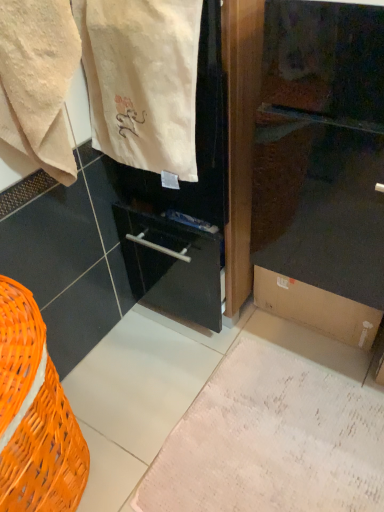
Question: Does brown cardboard box at lower right have a lesser height compared to white textured rug at lower center?

Choices:
 (A) no
 (B) yes

Answer: (A)

Question: Is brown cardboard box at lower right not inside white textured rug at lower center?

Choices:
 (A) no
 (B) yes

Answer: (B)

Question: Is brown cardboard box at lower right positioned before white textured rug at lower center?

Choices:
 (A) no
 (B) yes

Answer: (A)

Question: Is brown cardboard box at lower right to the left of white textured rug at lower center from the viewer's perspective?

Choices:
 (A) yes
 (B) no

Answer: (B)

Question: Is white textured rug at lower center surrounded by brown cardboard box at lower right?

Choices:
 (A) yes
 (B) no

Answer: (B)

Question: Considering the relative positions of brown cardboard box at lower right and beige cotton towel at upper left in the image provided, is brown cardboard box at lower right to the left or to the right of beige cotton towel at upper left?

Choices:
 (A) left
 (B) right

Answer: (B)

Question: From a real-world perspective, relative to beige cotton towel at upper left, is brown cardboard box at lower right vertically above or below?

Choices:
 (A) above
 (B) below

Answer: (B)

Question: Choose the correct answer: Is brown cardboard box at lower right inside beige cotton towel at upper left or outside it?

Choices:
 (A) outside
 (B) inside

Answer: (A)

Question: Based on their sizes in the image, would you say brown cardboard box at lower right is bigger or smaller than beige cotton towel at upper left?

Choices:
 (A) big
 (B) small

Answer: (A)

Question: Choose the correct answer: Is beige cotton towel at upper left inside white textured rug at lower center or outside it?

Choices:
 (A) inside
 (B) outside

Answer: (B)

Question: From a real-world perspective, relative to white textured rug at lower center, is beige cotton towel at upper left vertically above or below?

Choices:
 (A) below
 (B) above

Answer: (B)

Question: Is beige cotton towel at upper left bigger or smaller than white textured rug at lower center?

Choices:
 (A) small
 (B) big

Answer: (B)

Question: Based on their positions, is beige cotton towel at upper left located to the left or right of white textured rug at lower center?

Choices:
 (A) right
 (B) left

Answer: (B)

Question: Looking at their shapes, would you say beige cotton towel at upper left is wider or thinner than orange wicker basket at lower left?

Choices:
 (A) thin
 (B) wide

Answer: (A)

Question: Based on their sizes in the image, would you say beige cotton towel at upper left is bigger or smaller than orange wicker basket at lower left?

Choices:
 (A) small
 (B) big

Answer: (A)